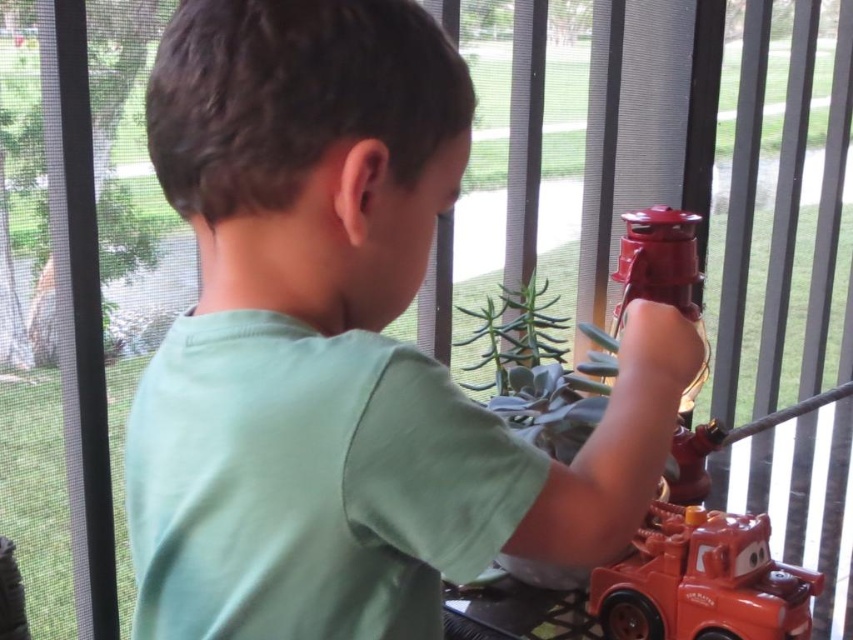
Does green matte shirt at center appear under shiny orange plastic toy car at lower right?

No.

Describe the element at coordinates (341, 346) in the screenshot. I see `green matte shirt at center` at that location.

Measure the distance between green matte shirt at center and camera.

The distance of green matte shirt at center from camera is 17.88 inches.

The height and width of the screenshot is (640, 853). I want to click on green matte shirt at center, so click(x=341, y=346).